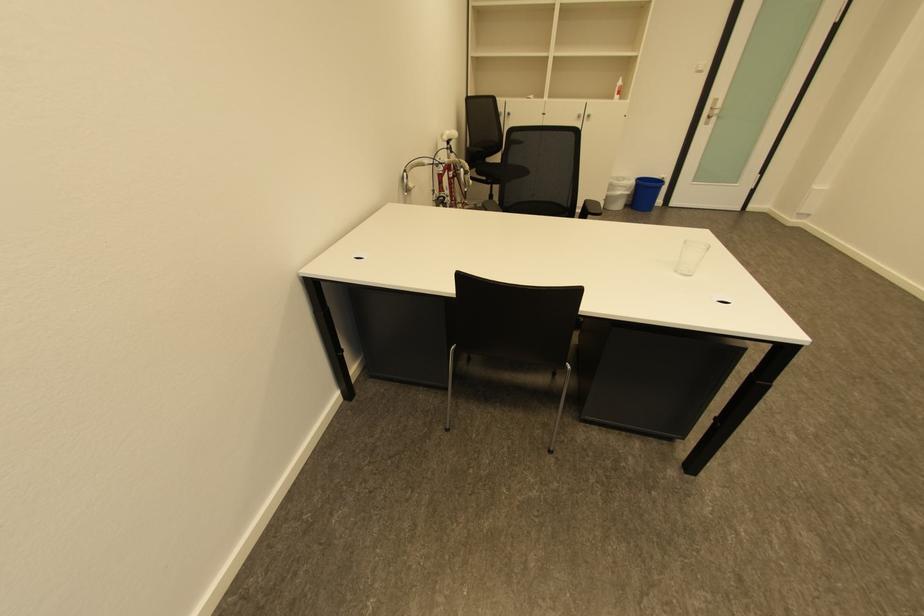
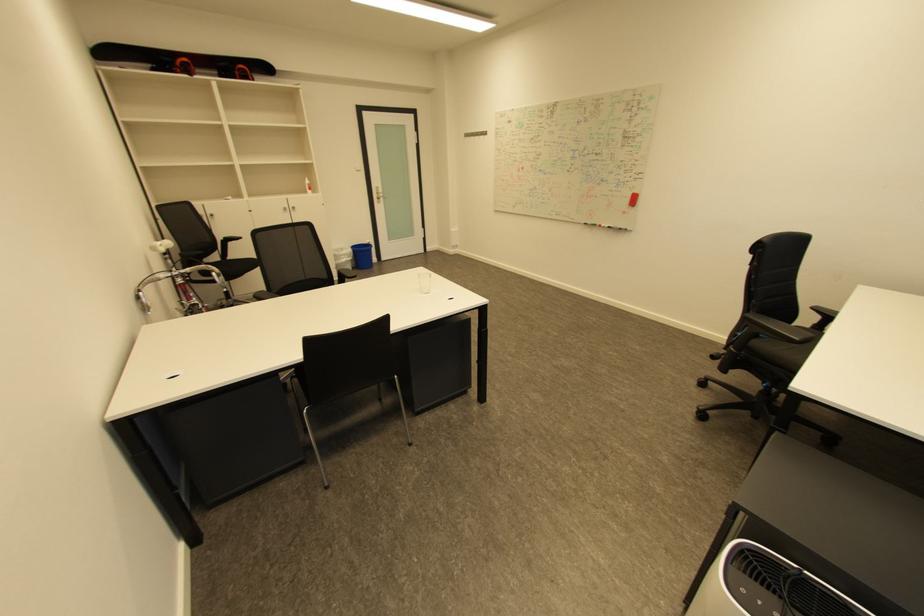
Question: The camera is either moving clockwise (left) or counter-clockwise (right) around the object. The first image is from the beginning of the video and the second image is from the end. Is the camera moving left or right when shooting the video?

Choices:
 (A) Left
 (B) Right

Answer: (A)